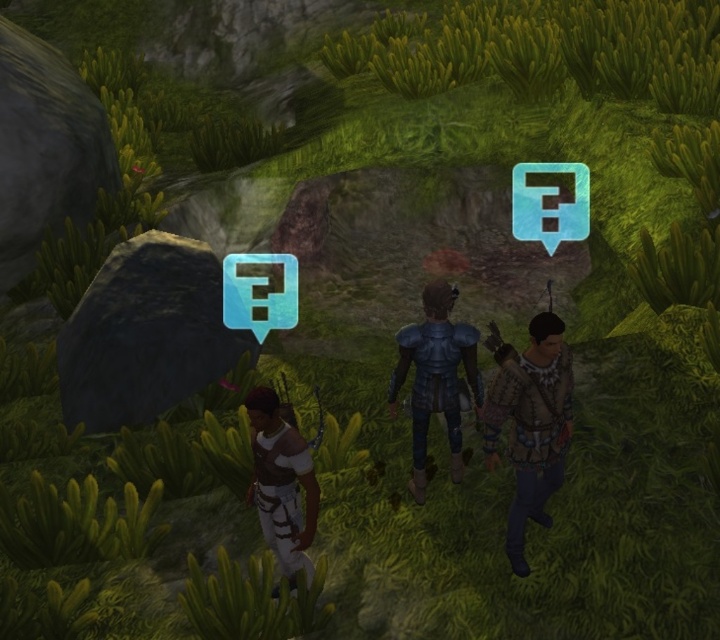
Question: Where is metallic blue armor at center located in relation to white leather pants at lower center in the image?

Choices:
 (A) above
 (B) below

Answer: (A)

Question: Among these points, which one is farthest from the camera?

Choices:
 (A) (288, 570)
 (B) (456, 385)

Answer: (B)

Question: Is brown leather vest at right above white leather pants at lower center?

Choices:
 (A) yes
 (B) no

Answer: (A)

Question: Based on their relative distances, which object is nearer to the brown leather vest at right?

Choices:
 (A) white leather pants at lower center
 (B) metallic blue armor at center

Answer: (B)

Question: Is metallic blue armor at center in front of white leather pants at lower center?

Choices:
 (A) yes
 (B) no

Answer: (B)

Question: Based on their relative distances, which object is nearer to the white leather pants at lower center?

Choices:
 (A) metallic blue armor at center
 (B) brown leather vest at right

Answer: (A)